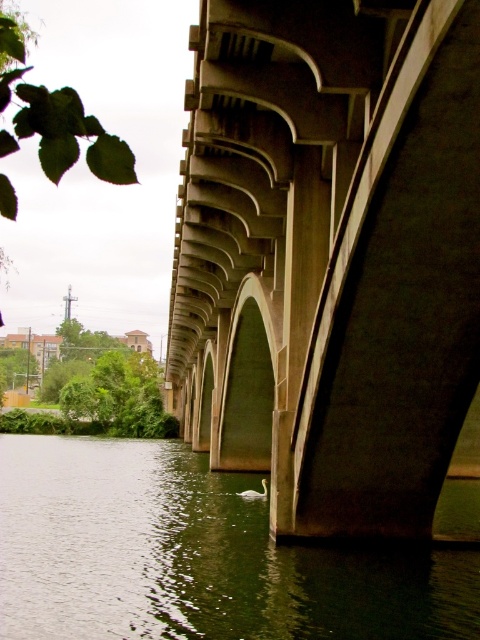
Question: Which of the following is the closest to the observer?

Choices:
 (A) (368, 173)
 (B) (336, 548)

Answer: (A)

Question: Which object appears closest to the camera in this image?

Choices:
 (A) green smooth water at lower center
 (B) white glossy swan at lower center

Answer: (A)

Question: Can you confirm if concrete at center is smaller than white glossy swan at lower center?

Choices:
 (A) yes
 (B) no

Answer: (B)

Question: Among these objects, which one is nearest to the camera?

Choices:
 (A) white glossy swan at lower center
 (B) green smooth water at lower center

Answer: (B)

Question: Can you confirm if concrete at center is wider than white glossy swan at lower center?

Choices:
 (A) no
 (B) yes

Answer: (B)

Question: Can you confirm if concrete at center is bigger than green smooth water at lower center?

Choices:
 (A) yes
 (B) no

Answer: (A)